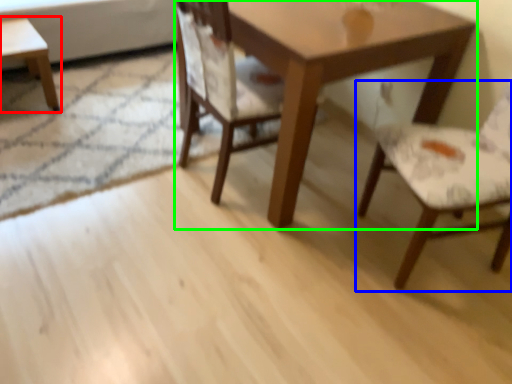
Question: Which object is positioned closest to coffee table (highlighted by a red box)? Select from chair (highlighted by a blue box) and table (highlighted by a green box).

Choices:
 (A) chair
 (B) table

Answer: (B)